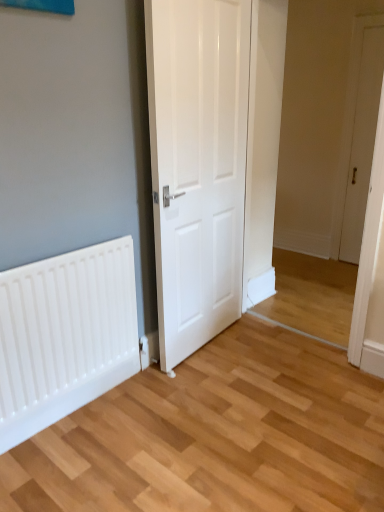
Identify the location of free space to the right of white matte radiator at lower left. (196, 403).